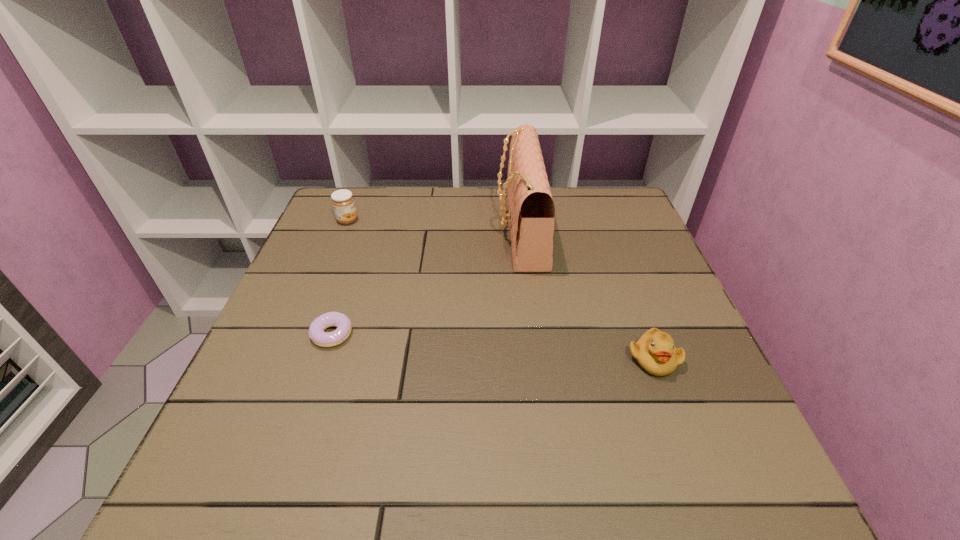
This screenshot has height=540, width=960. Find the location of `empty location between the tallest object and the jam`. empty location between the tallest object and the jam is located at coordinates (434, 225).

This screenshot has height=540, width=960. Identify the location of vacant area that lies between the shortest object and the jam. (340, 278).

Locate an element on the screen. free space that is in between the handbag and the shortest object is located at coordinates (426, 282).

The image size is (960, 540). I want to click on object identified as the second closest to the jam, so click(531, 208).

Select which object is the third closest to the duckling. Please provide its 2D coordinates. Your answer should be formatted as a tuple, i.e. [(x, y)], where the tuple contains the x and y coordinates of a point satisfying the conditions above.

[(343, 203)]

Find the location of a particular element. free space that satisfies the following two spatial constraints: 1. on the front-facing side of the third object from left to right; 2. on the front side of the shortest object is located at coordinates (533, 334).

The image size is (960, 540). What are the coordinates of `free spot that satisfies the following two spatial constraints: 1. on the back side of the shortest object; 2. on the front label of the jam` in the screenshot? It's located at (371, 220).

The width and height of the screenshot is (960, 540). What are the coordinates of `free region that satisfies the following two spatial constraints: 1. on the front label of the jam; 2. on the right side of the shortest object` in the screenshot? It's located at (301, 334).